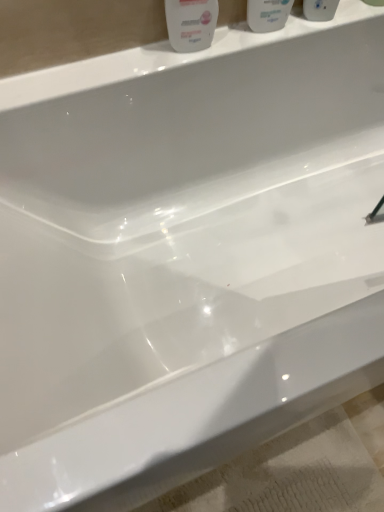
Image resolution: width=384 pixels, height=512 pixels. Describe the element at coordinates (374, 3) in the screenshot. I see `white glossy mouthwash at upper center, which is counted as the 1th mouthwash, starting from the right` at that location.

Locate an element on the screen. The height and width of the screenshot is (512, 384). white glossy mouthwash at upper center, positioned as the 2th mouthwash in left-to-right order is located at coordinates (374, 3).

From the image's perspective, does white glossy bottle at upper center appear lower than white glossy mouthwash at upper center, positioned as the 2th mouthwash in left-to-right order?

Yes.

Who is more distant, white glossy bottle at upper center or white glossy mouthwash at upper center, positioned as the 2th mouthwash in left-to-right order?

Positioned behind is white glossy mouthwash at upper center, positioned as the 2th mouthwash in left-to-right order.

Which object is thinner, white glossy bottle at upper center or white glossy mouthwash at upper center, which is counted as the 1th mouthwash, starting from the right?

With smaller width is white glossy mouthwash at upper center, which is counted as the 1th mouthwash, starting from the right.

Is white glossy mouthwash at upper center, which is counted as the 1th mouthwash, starting from the right, surrounded by white glossy bottle at upper center?

No.

Is white glossy bottle at upper center completely or partially inside white glossy mouthwash at upper center, which is counted as the 1th mouthwash, starting from the right?

No, white glossy bottle at upper center is not a part of white glossy mouthwash at upper center, which is counted as the 1th mouthwash, starting from the right.

Is white glossy mouthwash at upper center, which is counted as the 1th mouthwash, starting from the right, facing towards white glossy bottle at upper center?

No.

Does point (383, 6) come closer to viewer compared to point (182, 29)?

That is False.

Is white glossy mouthwash at upper center, which is counted as the 1th mouthwash, starting from the right, closer to camera compared to white glossy bottle at upper center?

No.

Is point (383, 6) closer to viewer compared to point (253, 5)?

No, (383, 6) is behind (253, 5).

Is white glossy mouthwash at upper center, which is counted as the 1th mouthwash, starting from the right, shorter than white glossy mouthwash at upper center, the 1th mouthwash in the left-to-right sequence?

No.

Is white glossy mouthwash at upper center, which is counted as the 1th mouthwash, starting from the right, at the right side of white glossy mouthwash at upper center, marked as the second mouthwash in a right-to-left arrangement?

Yes, white glossy mouthwash at upper center, which is counted as the 1th mouthwash, starting from the right, is to the right of white glossy mouthwash at upper center, marked as the second mouthwash in a right-to-left arrangement.

Do you think white glossy mouthwash at upper center, positioned as the 2th mouthwash in left-to-right order, is within white glossy mouthwash at upper center, marked as the second mouthwash in a right-to-left arrangement, or outside of it?

The correct answer is: outside.

Is white glossy bottle at upper center smaller than white glossy mouthwash at upper center, the 1th mouthwash in the left-to-right sequence?

Correct, white glossy bottle at upper center occupies less space than white glossy mouthwash at upper center, the 1th mouthwash in the left-to-right sequence.

Is white glossy bottle at upper center facing away from white glossy mouthwash at upper center, marked as the second mouthwash in a right-to-left arrangement?

No, white glossy mouthwash at upper center, marked as the second mouthwash in a right-to-left arrangement, is not at the back of white glossy bottle at upper center.

Is the surface of white glossy bottle at upper center in direct contact with white glossy mouthwash at upper center, marked as the second mouthwash in a right-to-left arrangement?

They are not placed beside each other.

Between white glossy bottle at upper center and white glossy mouthwash at upper center, the 1th mouthwash in the left-to-right sequence, which one has more height?

white glossy bottle at upper center is taller.

Is white glossy mouthwash at upper center, marked as the second mouthwash in a right-to-left arrangement, at the right side of white glossy mouthwash at upper center, which is counted as the 1th mouthwash, starting from the right?

In fact, white glossy mouthwash at upper center, marked as the second mouthwash in a right-to-left arrangement, is to the left of white glossy mouthwash at upper center, which is counted as the 1th mouthwash, starting from the right.

From the image's perspective, is white glossy mouthwash at upper center, the 1th mouthwash in the left-to-right sequence, located above or below white glossy mouthwash at upper center, which is counted as the 1th mouthwash, starting from the right?

From the image's perspective, white glossy mouthwash at upper center, the 1th mouthwash in the left-to-right sequence, appears below white glossy mouthwash at upper center, which is counted as the 1th mouthwash, starting from the right.

Which point is more forward, (254, 30) or (381, 1)?

Point (254, 30)

Measure the distance from white glossy mouthwash at upper center, marked as the second mouthwash in a right-to-left arrangement, to white glossy mouthwash at upper center, positioned as the 2th mouthwash in left-to-right order.

A distance of 9.43 inches exists between white glossy mouthwash at upper center, marked as the second mouthwash in a right-to-left arrangement, and white glossy mouthwash at upper center, positioned as the 2th mouthwash in left-to-right order.

Considering the positions of points (277, 6) and (191, 31), is point (277, 6) farther from camera compared to point (191, 31)?

Yes, point (277, 6) is behind point (191, 31).

Is white glossy mouthwash at upper center, the 1th mouthwash in the left-to-right sequence, next to white glossy bottle at upper center?

No, white glossy mouthwash at upper center, the 1th mouthwash in the left-to-right sequence, is not in contact with white glossy bottle at upper center.

How many degrees apart are the facing directions of white glossy mouthwash at upper center, the 1th mouthwash in the left-to-right sequence, and white glossy bottle at upper center?

0.0038 degrees.

Considering the positions of objects white glossy mouthwash at upper center, marked as the second mouthwash in a right-to-left arrangement, and white glossy bottle at upper center in the image provided, who is more to the left, white glossy mouthwash at upper center, marked as the second mouthwash in a right-to-left arrangement, or white glossy bottle at upper center?

white glossy bottle at upper center.

Where is `the 2nd mouthwash above when counting from the white glossy bottle at upper center (from the image's perspective)`? The height and width of the screenshot is (512, 384). the 2nd mouthwash above when counting from the white glossy bottle at upper center (from the image's perspective) is located at coordinates (374, 3).

Where is `cleaning product that is in front of the white glossy mouthwash at upper center, which is counted as the 1th mouthwash, starting from the right`? The width and height of the screenshot is (384, 512). cleaning product that is in front of the white glossy mouthwash at upper center, which is counted as the 1th mouthwash, starting from the right is located at coordinates (191, 23).

Looking at the image, which one is located closer to white glossy mouthwash at upper center, positioned as the 2th mouthwash in left-to-right order, white glossy mouthwash at upper center, the 1th mouthwash in the left-to-right sequence, or white glossy bottle at upper center?

white glossy mouthwash at upper center, the 1th mouthwash in the left-to-right sequence, is closer to white glossy mouthwash at upper center, positioned as the 2th mouthwash in left-to-right order.

When comparing their distances from white glossy bottle at upper center, does white glossy mouthwash at upper center, which is counted as the 1th mouthwash, starting from the right, or white glossy mouthwash at upper center, marked as the second mouthwash in a right-to-left arrangement, seem further?

Among the two, white glossy mouthwash at upper center, which is counted as the 1th mouthwash, starting from the right, is located further to white glossy bottle at upper center.

Considering their positions, is white glossy bottle at upper center positioned closer to white glossy mouthwash at upper center, the 1th mouthwash in the left-to-right sequence, than white glossy mouthwash at upper center, which is counted as the 1th mouthwash, starting from the right?

white glossy bottle at upper center.

Considering their positions, is white glossy mouthwash at upper center, marked as the second mouthwash in a right-to-left arrangement, positioned closer to white glossy bottle at upper center than white glossy mouthwash at upper center, which is counted as the 1th mouthwash, starting from the right?

white glossy mouthwash at upper center, marked as the second mouthwash in a right-to-left arrangement, is closer to white glossy bottle at upper center.

From the image, which object appears to be nearer to white glossy mouthwash at upper center, marked as the second mouthwash in a right-to-left arrangement, white glossy mouthwash at upper center, which is counted as the 1th mouthwash, starting from the right, or white glossy bottle at upper center?

white glossy bottle at upper center lies closer to white glossy mouthwash at upper center, marked as the second mouthwash in a right-to-left arrangement, than the other object.

Which object lies further to the anchor point white glossy mouthwash at upper center, positioned as the 2th mouthwash in left-to-right order, white glossy bottle at upper center or white glossy mouthwash at upper center, marked as the second mouthwash in a right-to-left arrangement?

white glossy bottle at upper center is positioned further to the anchor white glossy mouthwash at upper center, positioned as the 2th mouthwash in left-to-right order.

The image size is (384, 512). In order to click on mouthwash between white glossy bottle at upper center and white glossy mouthwash at upper center, positioned as the 2th mouthwash in left-to-right order, in the horizontal direction in this screenshot , I will do `click(268, 14)`.